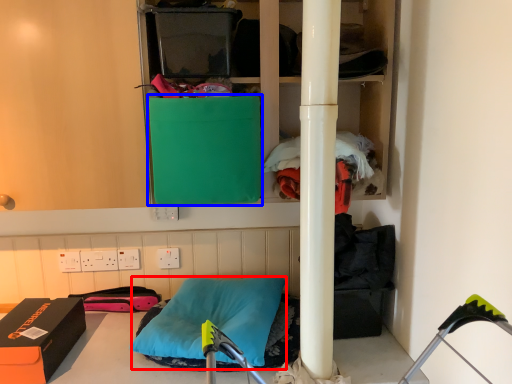
Question: Which object is further to the camera taking this photo, pillow (highlighted by a red box) or box (highlighted by a blue box)?

Choices:
 (A) pillow
 (B) box

Answer: (A)